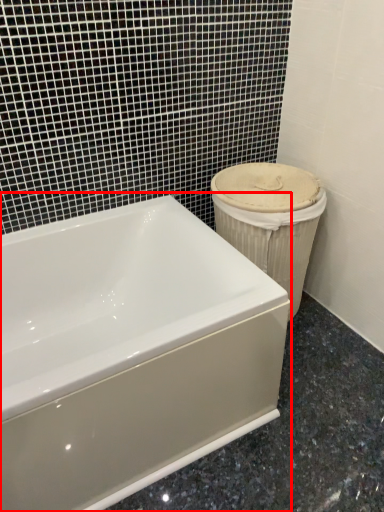
Question: In this image, where is bathtub (annotated by the red box) located relative to porcelain?

Choices:
 (A) left
 (B) right

Answer: (A)